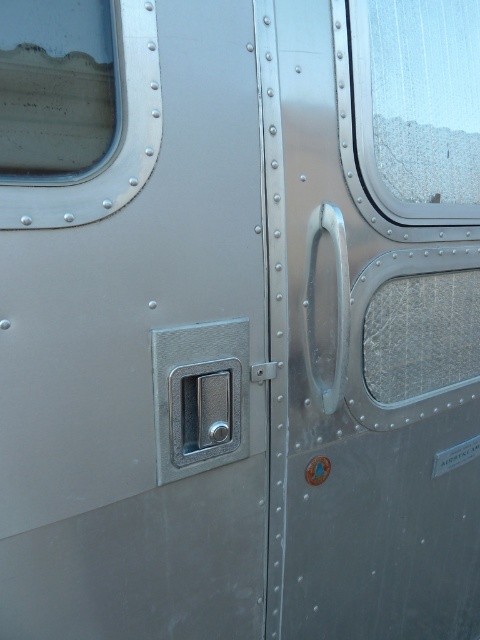
Question: Can you confirm if metallic silver handle at center right is positioned below frosted glass window at upper right?

Choices:
 (A) yes
 (B) no

Answer: (A)

Question: Is metallic gray lock at center above polished metal handle at center?

Choices:
 (A) no
 (B) yes

Answer: (A)

Question: Does metallic silver handle at center right lie behind polished metal handle at center?

Choices:
 (A) yes
 (B) no

Answer: (B)

Question: Which object appears closest to the camera in this image?

Choices:
 (A) metallic silver handle at center right
 (B) metallic textured window at upper left
 (C) polished metal handle at center
 (D) frosted glass window at upper right

Answer: (B)

Question: Which point is closer to the camera?

Choices:
 (A) polished metal handle at center
 (B) frosted glass window at upper right
 (C) metallic silver handle at center right
 (D) metallic textured window at upper left

Answer: (D)

Question: Which point appears farthest from the camera in this image?

Choices:
 (A) (216, 401)
 (B) (338, 140)
 (C) (321, 230)

Answer: (B)